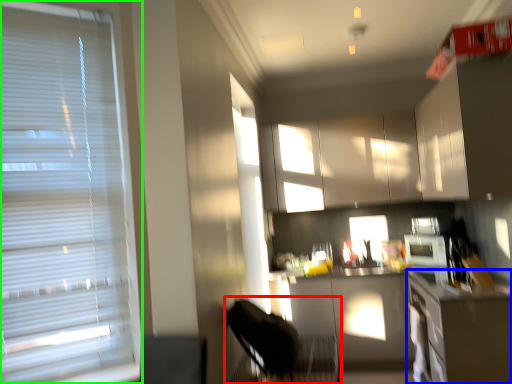
Question: Which object is the farthest from swivel chair (highlighted by a red box)? Choose among these: counter top (highlighted by a blue box) or window blind (highlighted by a green box).

Choices:
 (A) counter top
 (B) window blind

Answer: (B)